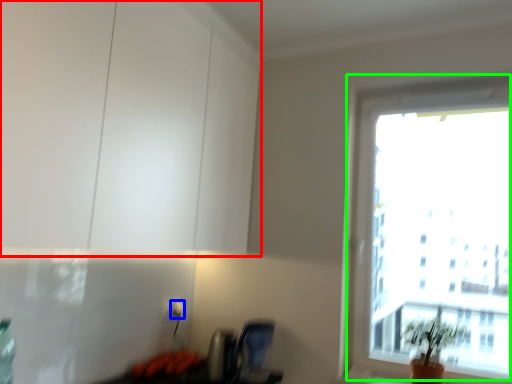
Question: Which object is the closest to the cabinetry (highlighted by a red box)? Choose among these: electric outlet (highlighted by a blue box) or window (highlighted by a green box).

Choices:
 (A) electric outlet
 (B) window

Answer: (A)